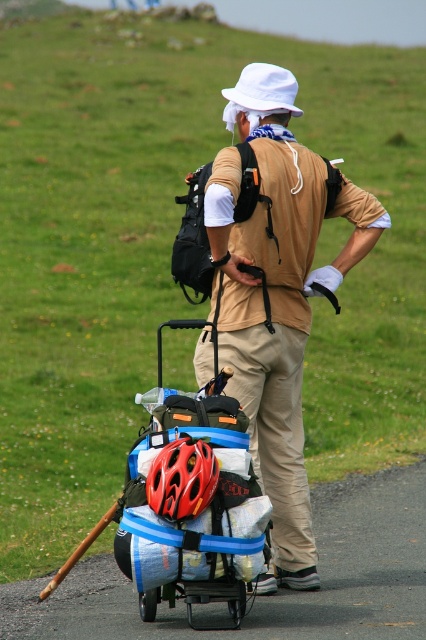
Question: Which object is positioned closest to the tan fabric backpack at center?

Choices:
 (A) shiny red helmet at center
 (B) khaki pants at center

Answer: (B)

Question: Which point is closer to the camera taking this photo?

Choices:
 (A) (163, 396)
 (B) (221, 326)

Answer: (A)

Question: Where is khaki pants at center located in relation to shiny red helmet at center in the image?

Choices:
 (A) right
 (B) left

Answer: (A)

Question: Does tan fabric backpack at center appear on the right side of shiny red helmet at center?

Choices:
 (A) yes
 (B) no

Answer: (A)

Question: Which point is closer to the camera?

Choices:
 (A) (233, 464)
 (B) (169, 502)
 (C) (285, 484)
 (D) (294, 355)

Answer: (B)

Question: Is matte black wagon at center smaller than khaki pants at center?

Choices:
 (A) no
 (B) yes

Answer: (A)